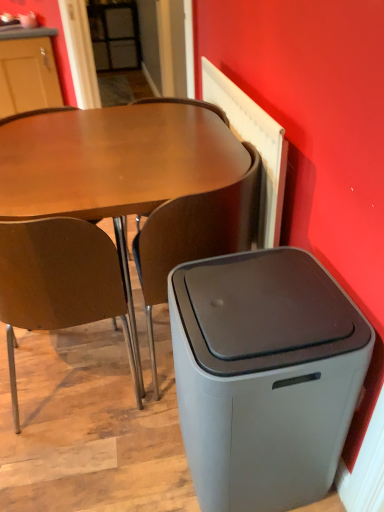
Question: Considering the relative sizes of matte brown desk at center and brown matte chair at center, which is counted as the 2th chair, starting from the left, in the image provided, is matte brown desk at center wider than brown matte chair at center, which is counted as the 2th chair, starting from the left,?

Choices:
 (A) no
 (B) yes

Answer: (B)

Question: Considering the relative positions of matte brown desk at center and brown matte chair at center, the first chair positioned from the right, in the image provided, is matte brown desk at center to the left of brown matte chair at center, the first chair positioned from the right, from the viewer's perspective?

Choices:
 (A) yes
 (B) no

Answer: (A)

Question: From a real-world perspective, does matte brown desk at center sit lower than brown matte chair at center, which is counted as the 2th chair, starting from the left?

Choices:
 (A) no
 (B) yes

Answer: (B)

Question: From a real-world perspective, is matte brown desk at center on brown matte chair at center, the first chair positioned from the right?

Choices:
 (A) no
 (B) yes

Answer: (A)

Question: Is brown matte chair at center, the first chair positioned from the right, at the back of matte brown desk at center?

Choices:
 (A) no
 (B) yes

Answer: (B)

Question: Looking at their shapes, would you say brown wood chair at left, positioned as the first chair in left-to-right order, is wider or thinner than brown matte chair at center, the first chair positioned from the right?

Choices:
 (A) thin
 (B) wide

Answer: (B)

Question: Choose the correct answer: Is brown wood chair at left, which is the second chair in right-to-left order, inside brown matte chair at center, which is counted as the 2th chair, starting from the left, or outside it?

Choices:
 (A) outside
 (B) inside

Answer: (A)

Question: From the image's perspective, is brown wood chair at left, positioned as the first chair in left-to-right order, positioned above or below brown matte chair at center, which is counted as the 2th chair, starting from the left?

Choices:
 (A) above
 (B) below

Answer: (B)

Question: In the image, is brown wood chair at left, positioned as the first chair in left-to-right order, on the left side or the right side of brown matte chair at center, the first chair positioned from the right?

Choices:
 (A) right
 (B) left

Answer: (B)

Question: Is gray matte trash bin/can at lower right wider or thinner than brown wood chair at left, which is the second chair in right-to-left order?

Choices:
 (A) thin
 (B) wide

Answer: (A)

Question: From a real-world perspective, relative to brown wood chair at left, positioned as the first chair in left-to-right order, is gray matte trash bin/can at lower right vertically above or below?

Choices:
 (A) above
 (B) below

Answer: (B)

Question: Is point click(x=302, y=464) closer or farther from the camera than point click(x=66, y=264)?

Choices:
 (A) closer
 (B) farther

Answer: (A)

Question: Based on their positions, is gray matte trash bin/can at lower right located to the left or right of brown wood chair at left, positioned as the first chair in left-to-right order?

Choices:
 (A) right
 (B) left

Answer: (A)

Question: In the image, is brown wood chair at left, positioned as the first chair in left-to-right order, positioned in front of or behind gray matte trash bin/can at lower right?

Choices:
 (A) front
 (B) behind

Answer: (B)

Question: Looking at their shapes, would you say brown wood chair at left, positioned as the first chair in left-to-right order, is wider or thinner than gray matte trash bin/can at lower right?

Choices:
 (A) thin
 (B) wide

Answer: (B)